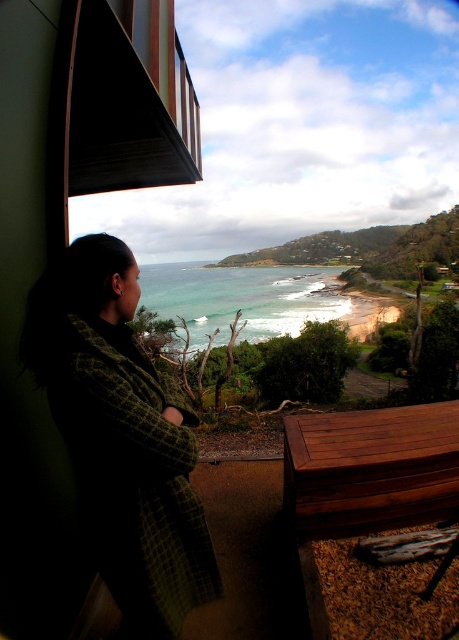
You are standing at the window looking out at the coastal scene. There are two points marked in the image. Which point, point [136,285] or point [246,284], is closer to you?

Point [136,285] is closer to the camera than point [246,284], so it is closer to you.

You are standing inside a building and looking through the window. You see a rustic wood balcony at upper left and green water at center. Which object is positioned to the right of the other?

The rustic wood balcony at upper left is to the right of green water at center.

You are standing inside a building and looking out through a window. You see a rustic wood balcony at upper left and green water at center. Which object is lower in height?

The rustic wood balcony at upper left is lower in height compared to the green water at center.